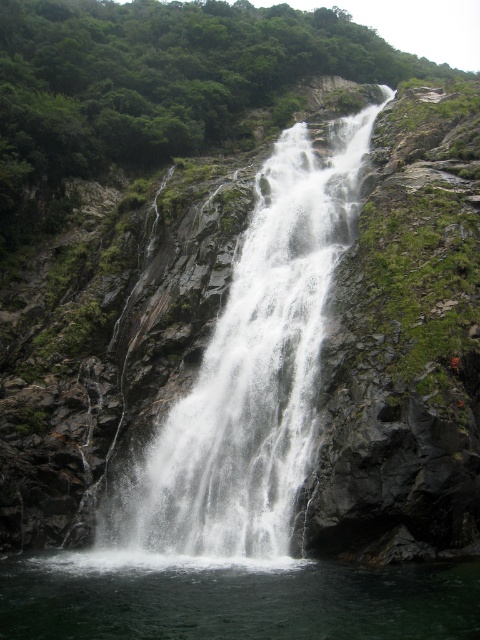
Question: Which point appears closest to the camera in this image?

Choices:
 (A) (415, 604)
 (B) (238, 360)

Answer: (A)

Question: Does white frothy water at center appear on the right side of clear water at center?

Choices:
 (A) no
 (B) yes

Answer: (B)

Question: Is white frothy water at center further to camera compared to clear water at center?

Choices:
 (A) yes
 (B) no

Answer: (A)

Question: Which of the following is the closest to the observer?

Choices:
 (A) (384, 595)
 (B) (259, 451)

Answer: (A)

Question: Does white frothy water at center have a smaller size compared to clear water at center?

Choices:
 (A) yes
 (B) no

Answer: (B)